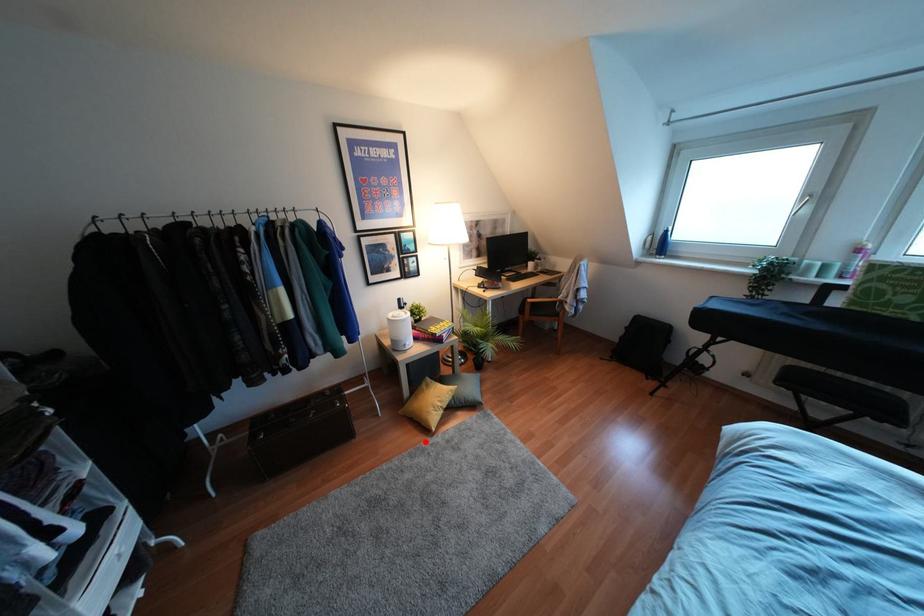
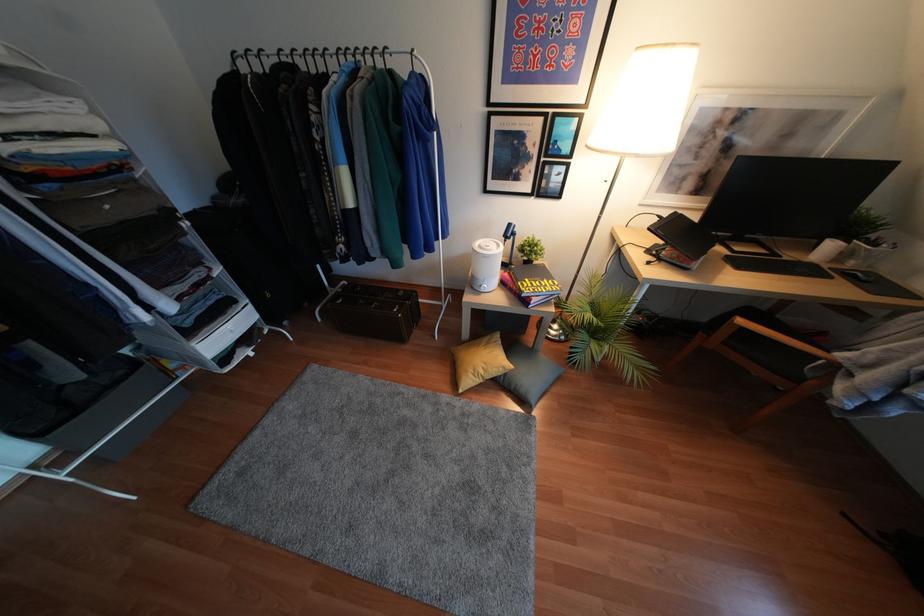
Question: I am providing you with two images of the same scene from different viewpoints. A red point is marked on the first image. Can you still see the location of the red point in image 2?

Choices:
 (A) Yes
 (B) No

Answer: (A)